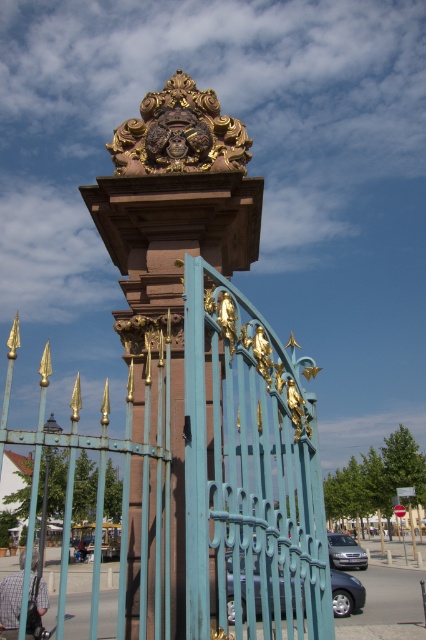
Question: Does teal painted metal gate at center lie behind gold ornate sculpture at upper center?

Choices:
 (A) no
 (B) yes

Answer: (A)

Question: Does teal painted metal gate at center lie behind gold ornate sculpture at upper center?

Choices:
 (A) no
 (B) yes

Answer: (A)

Question: Does polished bronze sculpture at center appear on the left side of gold ornate sculpture at upper center?

Choices:
 (A) no
 (B) yes

Answer: (A)

Question: Which point is closer to the camera taking this photo?

Choices:
 (A) (186, 250)
 (B) (250, 156)
 (C) (245, 496)

Answer: (C)

Question: Which of the following is the closest to the observer?

Choices:
 (A) teal painted metal gate at center
 (B) gold ornate sculpture at upper center

Answer: (A)

Question: Which is farther from the teal painted metal gate at center?

Choices:
 (A) polished bronze sculpture at center
 (B) gold ornate sculpture at upper center

Answer: (B)